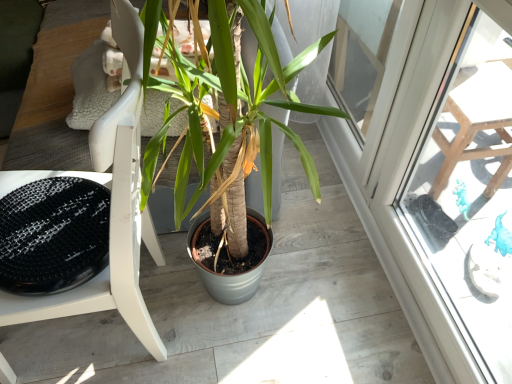
This screenshot has height=384, width=512. Identify the location of vacant area that is situated to the right of white matte chair at center. coord(259,314).